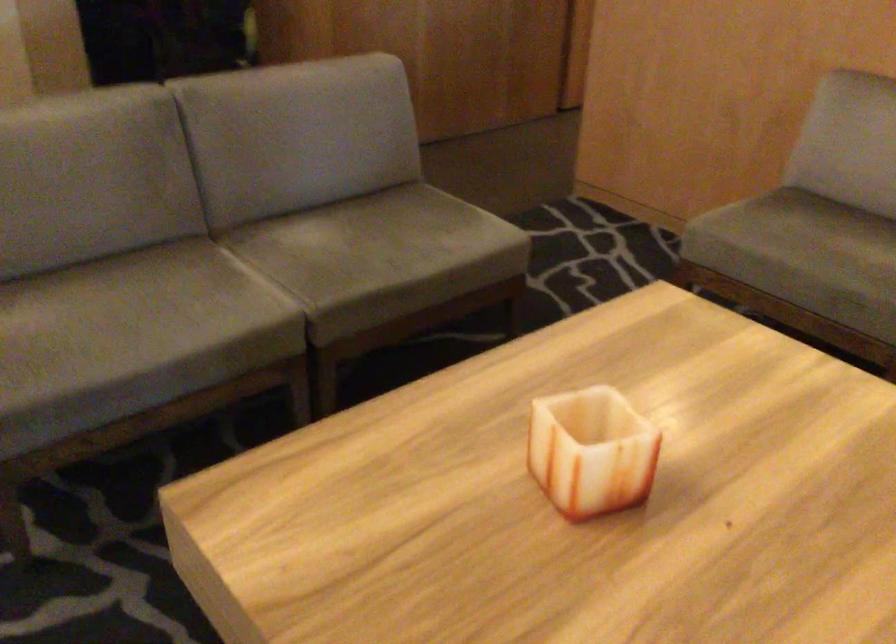
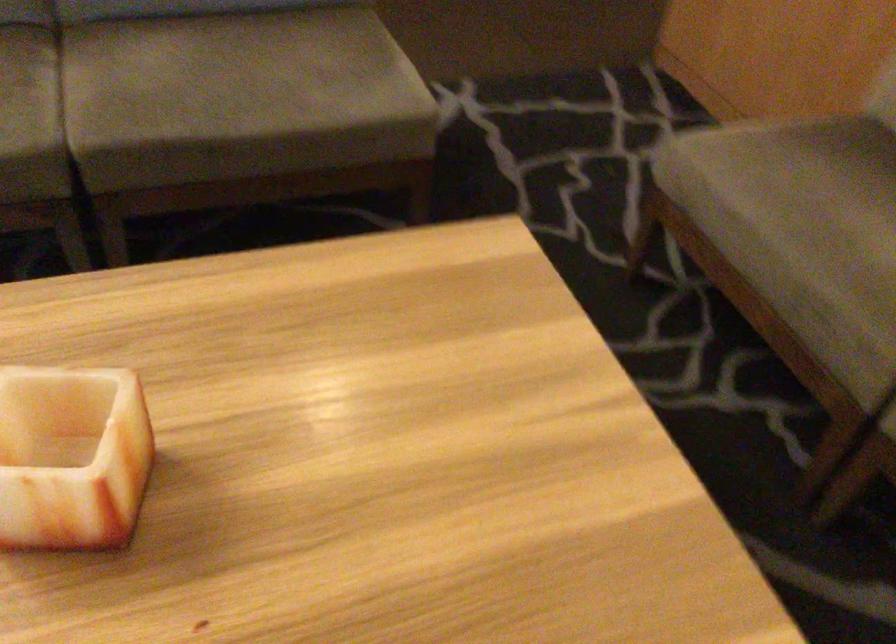
Question: The first image is from the beginning of the video and the second image is from the end. How did the camera likely rotate when shooting the video?

Choices:
 (A) Left
 (B) Right
 (C) Up
 (D) Down

Answer: (D)